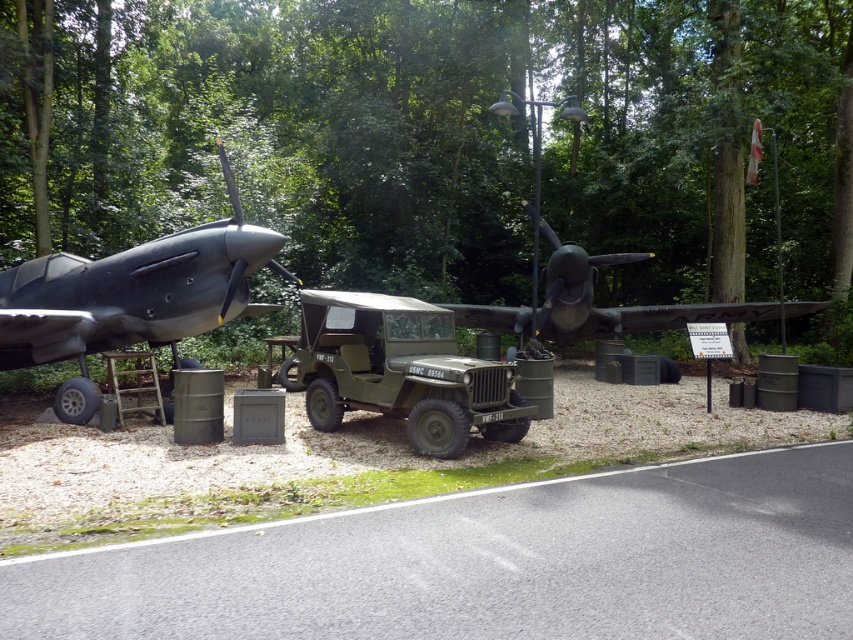
Question: Among these points, which one is nearest to the camera?

Choices:
 (A) (329, 305)
 (B) (541, 308)
 (C) (607, 292)

Answer: (A)

Question: Which object is the farthest from the green textured tree at upper center?

Choices:
 (A) matte black airplane at left
 (B) matte green jeep at center
 (C) matte black airplane at center

Answer: (B)

Question: Does green textured tree at upper center have a smaller size compared to matte black airplane at left?

Choices:
 (A) no
 (B) yes

Answer: (A)

Question: Which point is closer to the camera?

Choices:
 (A) green textured tree at upper center
 (B) matte green jeep at center
 (C) matte black airplane at center

Answer: (B)

Question: Does green textured tree at upper center appear over matte black airplane at left?

Choices:
 (A) yes
 (B) no

Answer: (A)

Question: Is green textured tree at upper center further to the viewer compared to matte black airplane at left?

Choices:
 (A) no
 (B) yes

Answer: (B)